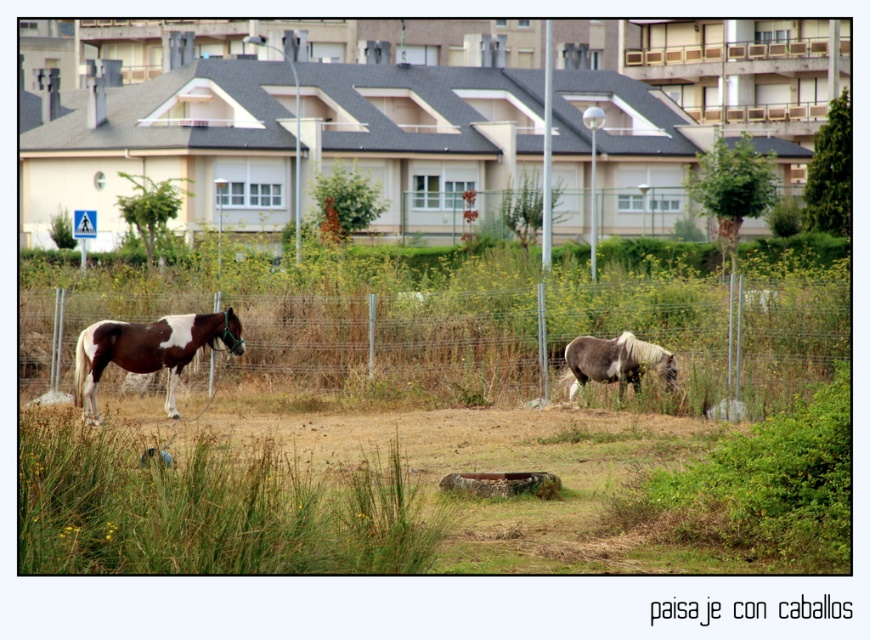
Question: Which of the following is the closest to the observer?

Choices:
 (A) (201, 342)
 (B) (492, 394)
 (C) (610, 348)

Answer: (A)

Question: Does wire mesh fence at center have a larger size compared to gray and white textured horse at center?

Choices:
 (A) yes
 (B) no

Answer: (A)

Question: Estimate the real-world distances between objects in this image. Which object is farther from the wire mesh fence at center?

Choices:
 (A) gray and white textured horse at center
 (B) brown and white speckled horse at left

Answer: (B)

Question: Is brown and white speckled horse at left smaller than gray and white textured horse at center?

Choices:
 (A) no
 (B) yes

Answer: (A)

Question: Among these objects, which one is nearest to the camera?

Choices:
 (A) brown and white speckled horse at left
 (B) wire mesh fence at center

Answer: (B)

Question: Does wire mesh fence at center have a lesser width compared to gray and white textured horse at center?

Choices:
 (A) yes
 (B) no

Answer: (B)